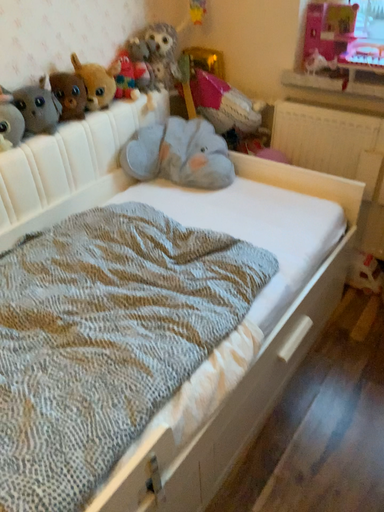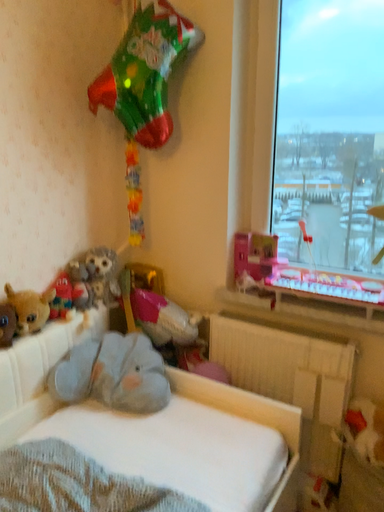
Question: How did the camera likely rotate when shooting the video?

Choices:
 (A) rotated upward
 (B) rotated downward

Answer: (A)